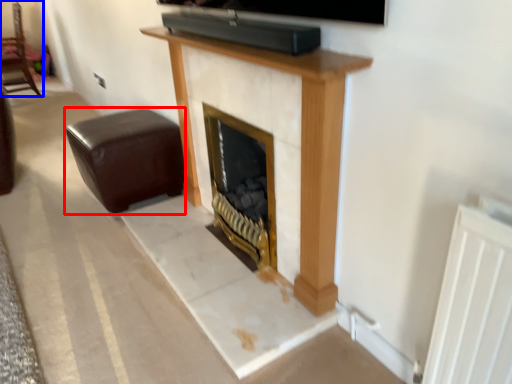
Question: Which object appears farthest to the camera in this image, furniture (highlighted by a red box) or furniture (highlighted by a blue box)?

Choices:
 (A) furniture
 (B) furniture

Answer: (B)